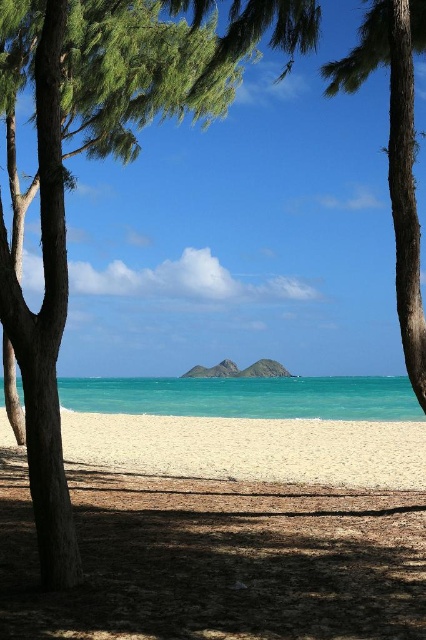
You are standing on the white sandy beach at center and want to reach the turquoise water at center. Which direction should you walk to get to the water?

You should walk forward because the white sandy beach at center is positioned over the turquoise water at center, meaning the water is directly in front of you.

You are standing on the white sandy beach at center and want to walk to the turquoise water at center. In which direction should you head?

You should head to the left because the white sandy beach at center is to the right of the turquoise water at center, so moving left will take you towards the water.